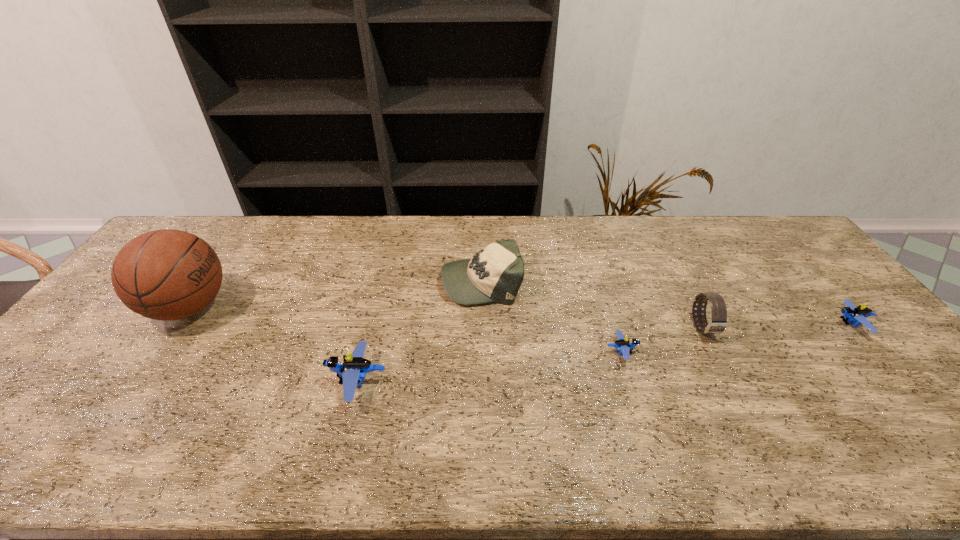
Image resolution: width=960 pixels, height=540 pixels. Find the location of `blank area located on the side with brand label of the basketball`. blank area located on the side with brand label of the basketball is located at coordinates (370, 307).

This screenshot has width=960, height=540. Identify the location of vacant space situated 0.200m on the face of the watch. (744, 409).

This screenshot has height=540, width=960. What are the coordinates of `object present at the near edge` in the screenshot? It's located at (354, 368).

This screenshot has width=960, height=540. In order to click on object positioned at the left edge in this screenshot , I will do `click(167, 274)`.

At what (x,y) coordinates should I click in order to perform the action: click on object that is at the right edge. Please return your answer as a coordinate pair (x, y). Looking at the image, I should click on (851, 313).

Where is `free space at the far edge`? Image resolution: width=960 pixels, height=540 pixels. free space at the far edge is located at coordinates (324, 229).

You are a GUI agent. You are given a task and a screenshot of the screen. Output one action in this format:
    pyautogui.click(x=<x>, y=<y>)
    Task: Click on the free space at the near edge
    This screenshot has height=540, width=960.
    Given the screenshot: What is the action you would take?
    pyautogui.click(x=773, y=413)

At what (x,y) coordinates should I click in order to perform the action: click on vacant space at the far right corner of the desktop. Please return your answer as a coordinate pair (x, y). The image size is (960, 540). Looking at the image, I should click on (760, 242).

You are a GUI agent. You are given a task and a screenshot of the screen. Output one action in this format:
    pyautogui.click(x=<x>, y=<y>)
    Task: Click on the free space between the rightmost Lego and the leftmost Lego
    
    Given the screenshot: What is the action you would take?
    pyautogui.click(x=605, y=353)

This screenshot has height=540, width=960. What are the coordinates of `vacant space that is in between the watch and the leftmost object` in the screenshot? It's located at (445, 318).